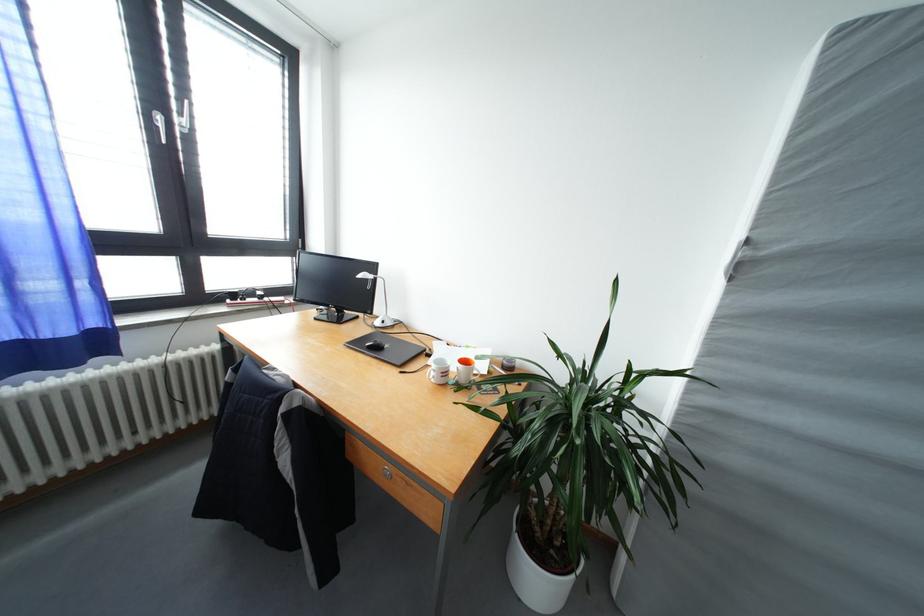
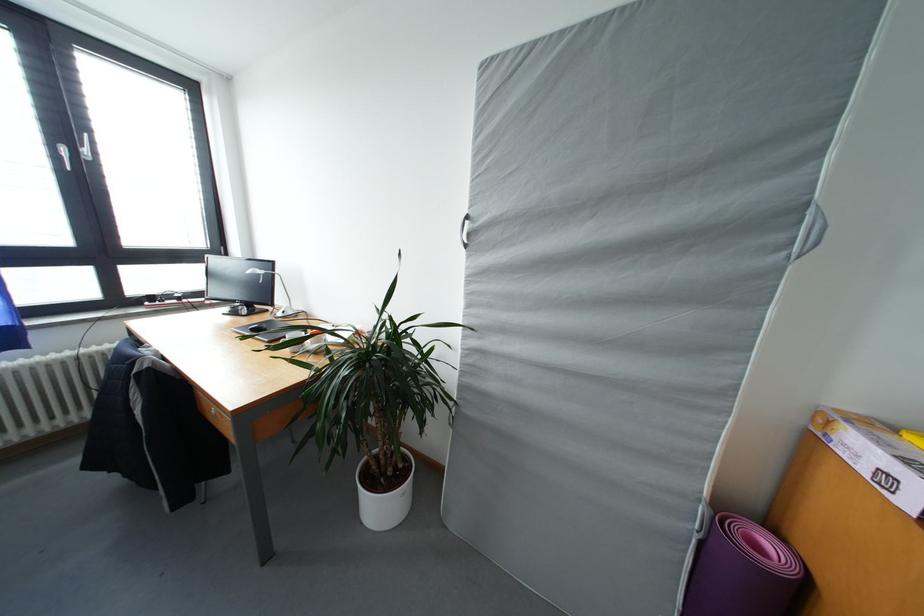
Question: Which direction would the cameraman need to move to produce the second image? Reply with the corresponding letter.

Choices:
 (A) Left
 (B) Right
 (C) Forward
 (D) Backward

Answer: (B)